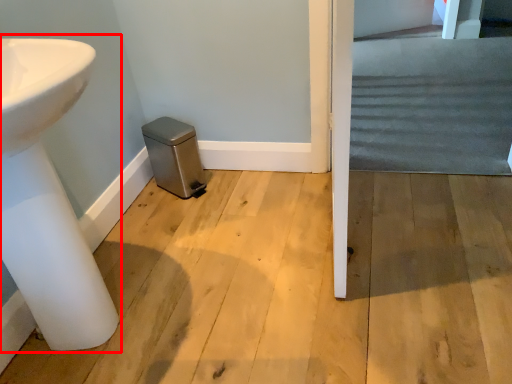
Question: From the image's perspective, where is sink (annotated by the red box) located relative to stairwell?

Choices:
 (A) above
 (B) below

Answer: (B)